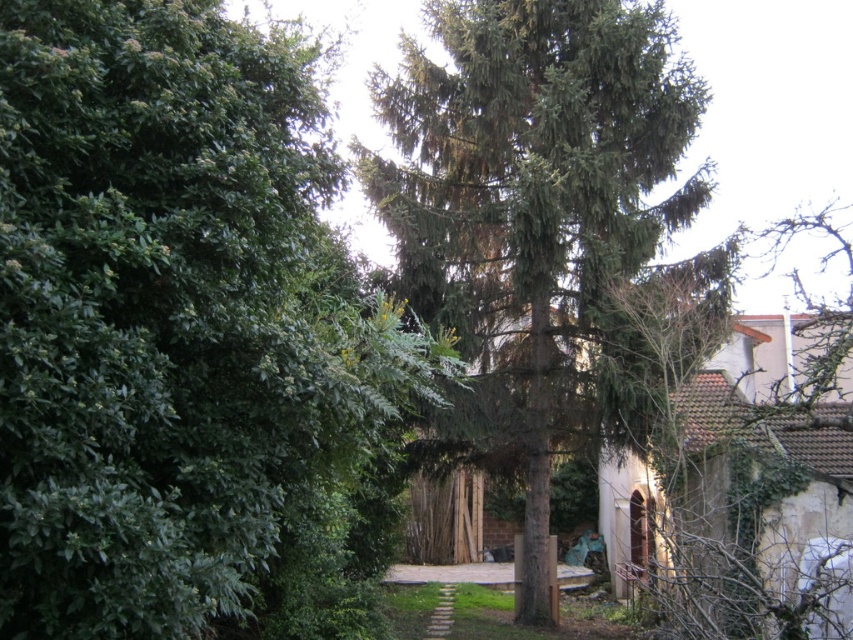
Question: Is green leafy tree at left smaller than green textured tree at center?

Choices:
 (A) yes
 (B) no

Answer: (A)

Question: Which point appears farthest from the camera in this image?

Choices:
 (A) (386, 397)
 (B) (546, 433)

Answer: (B)

Question: Which object is farther from the camera taking this photo?

Choices:
 (A) green leafy tree at left
 (B) green textured tree at center

Answer: (B)

Question: Is green leafy tree at left to the right of green textured tree at center from the viewer's perspective?

Choices:
 (A) no
 (B) yes

Answer: (A)

Question: From the image, what is the correct spatial relationship of green leafy tree at left in relation to green textured tree at center?

Choices:
 (A) below
 (B) above

Answer: (A)

Question: Among these objects, which one is nearest to the camera?

Choices:
 (A) green textured tree at center
 (B) green leafy tree at left

Answer: (B)